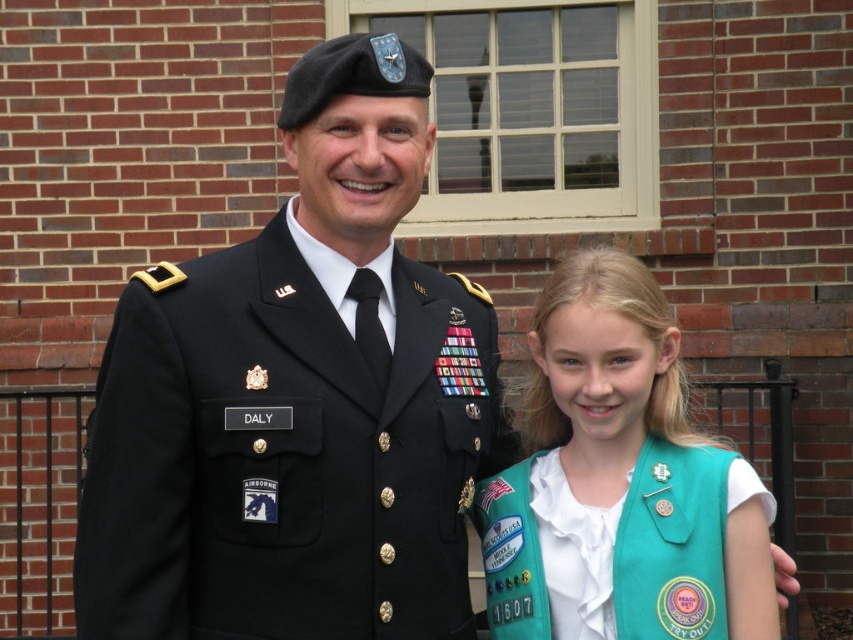
Does black matte uniform at center come in front of teal fabric vest at right?

Yes.

Who is more distant from viewer, (271, 500) or (753, 536)?

The point (753, 536) is behind.

Locate an element on the screen. black matte uniform at center is located at coordinates (299, 401).